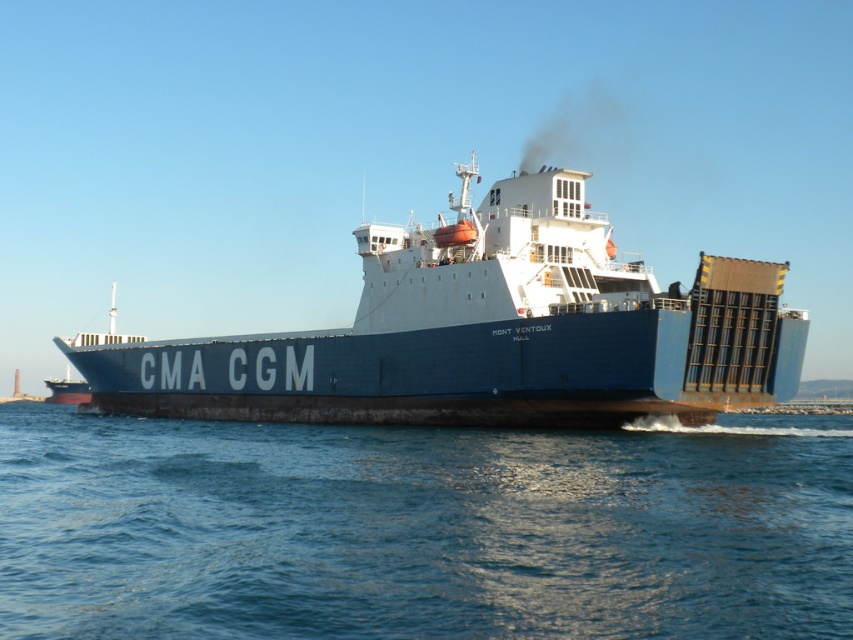
Question: Which point appears farthest from the camera in this image?

Choices:
 (A) (387, 259)
 (B) (566, 513)

Answer: (A)

Question: Does blue water at center have a larger size compared to blue matte container ship at center?

Choices:
 (A) yes
 (B) no

Answer: (B)

Question: Which of the following is the closest to the observer?

Choices:
 (A) (630, 525)
 (B) (111, 339)

Answer: (A)

Question: Does blue water at center have a greater width compared to blue matte container ship at center?

Choices:
 (A) yes
 (B) no

Answer: (B)

Question: Can you confirm if blue water at center is bigger than blue matte container ship at center?

Choices:
 (A) yes
 (B) no

Answer: (B)